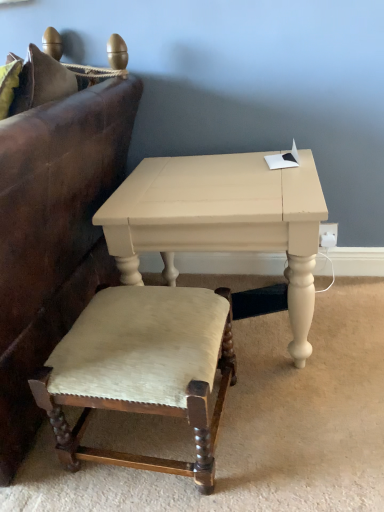
In order to click on empty space that is ontop of matte white table at center in this screenshot , I will do `click(206, 177)`.